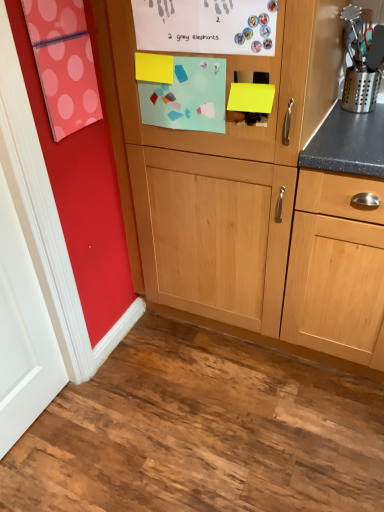
The width and height of the screenshot is (384, 512). Find the location of `unoccupied area in front of white matte door at left`. unoccupied area in front of white matte door at left is located at coordinates (52, 475).